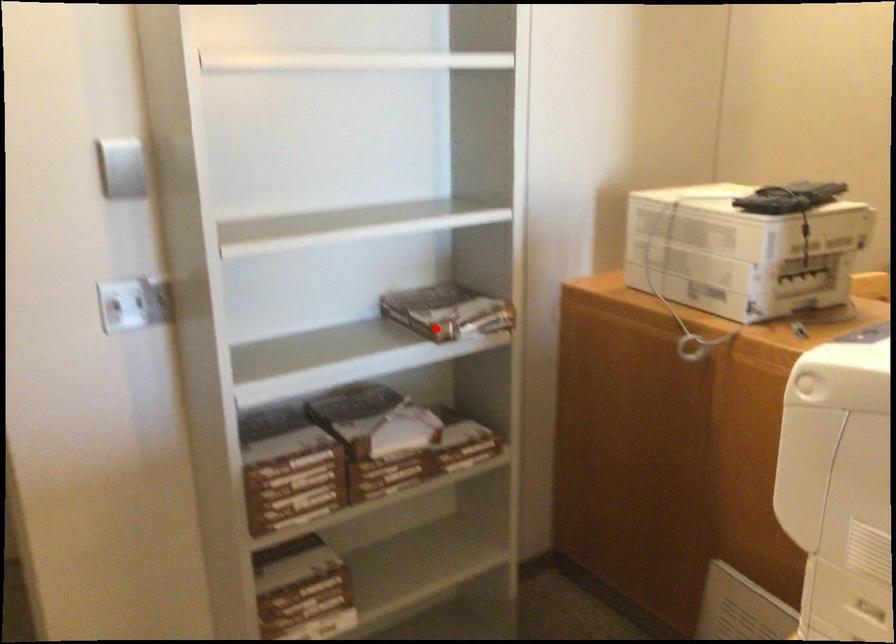
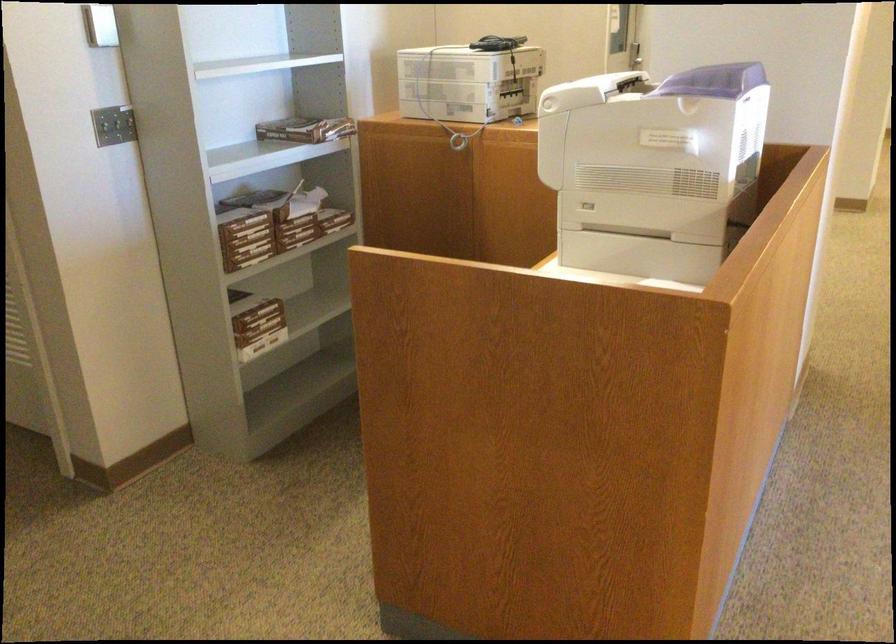
Question: I am providing you with two images of the same scene from different viewpoints. Given a red point in image1, look at the same physical point in image2. Is it:

Choices:
 (A) Closer to the viewpoint
 (B) Farther from the viewpoint

Answer: (B)